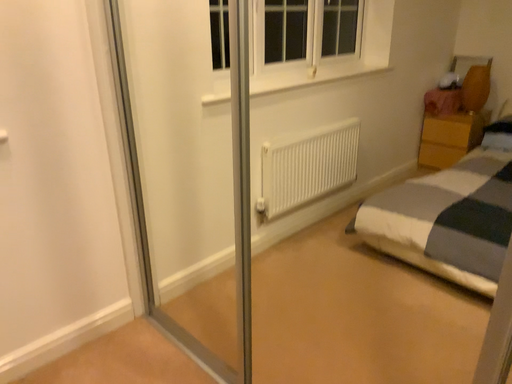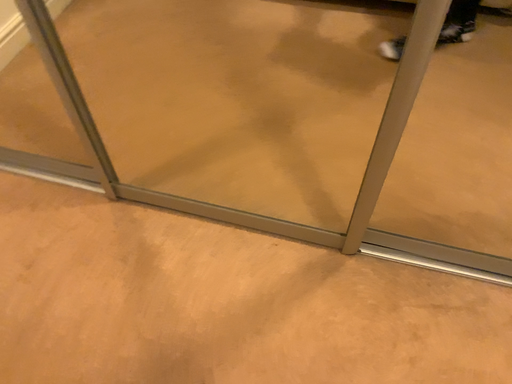
Question: How did the camera likely rotate when shooting the video?

Choices:
 (A) rotated upward
 (B) rotated downward

Answer: (B)